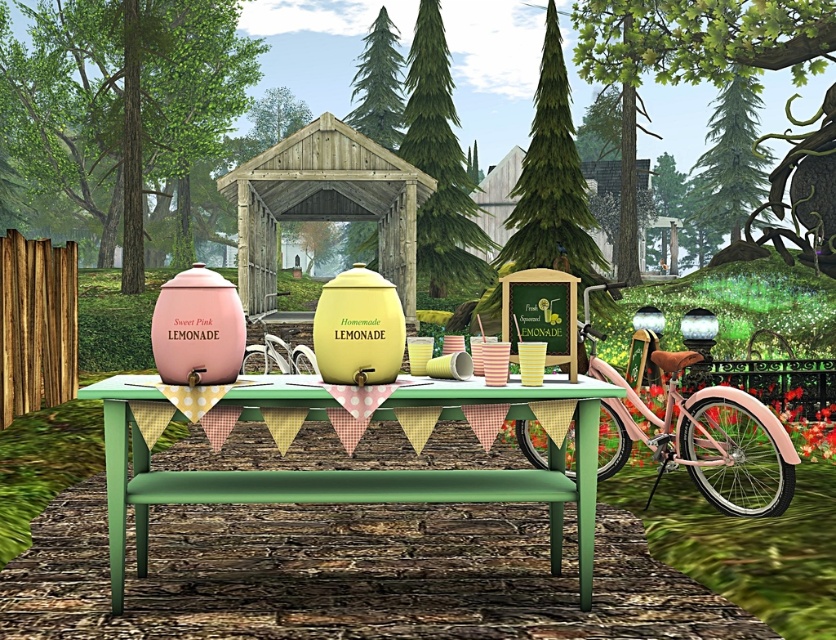
Is green wooden table at center positioned in front of wooden hut at center?

Yes.

Describe the element at coordinates (358, 470) in the screenshot. I see `green wooden table at center` at that location.

Where is `green wooden table at center`? The image size is (836, 640). green wooden table at center is located at coordinates (358, 470).

Is wooden gazebo at center smaller than wooden hut at center?

Indeed, wooden gazebo at center has a smaller size compared to wooden hut at center.

Between point (403, 266) and point (487, 224), which one is positioned in front?

Point (403, 266) is in front.

Find the location of a particular element. This screenshot has height=640, width=836. wooden gazebo at center is located at coordinates (324, 204).

Does wooden gazebo at center lie in front of pink matte bicycle at right?

No, it is not.

Does wooden gazebo at center appear on the right side of pink matte bicycle at right?

Incorrect, wooden gazebo at center is not on the right side of pink matte bicycle at right.

Looking at this image, who is more forward, (413, 179) or (717, 456)?

Point (717, 456) is more forward.

Where is `wooden gazebo at center`? This screenshot has width=836, height=640. wooden gazebo at center is located at coordinates (324, 204).